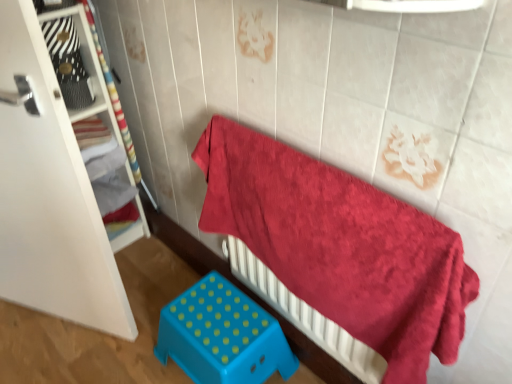
Question: Is blue plastic stool at lower center bigger or smaller than white wood shelf at left?

Choices:
 (A) big
 (B) small

Answer: (B)

Question: In the image, is blue plastic stool at lower center positioned in front of or behind white wood shelf at left?

Choices:
 (A) front
 (B) behind

Answer: (A)

Question: Based on their relative distances, which object is farther from the white wood shelf at left?

Choices:
 (A) blue plastic stool at lower center
 (B) fluffy red towel at upper right

Answer: (B)

Question: Estimate the real-world distances between objects in this image. Which object is closer to the fluffy red towel at upper right?

Choices:
 (A) white wood shelf at left
 (B) blue plastic stool at lower center

Answer: (B)